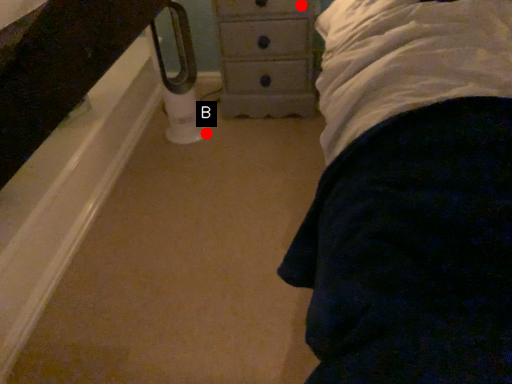
Question: Two points are circled on the image, labeled by A and B beside each circle. Which point is farther from the camera taking this photo?

Choices:
 (A) A is further
 (B) B is further

Answer: (B)